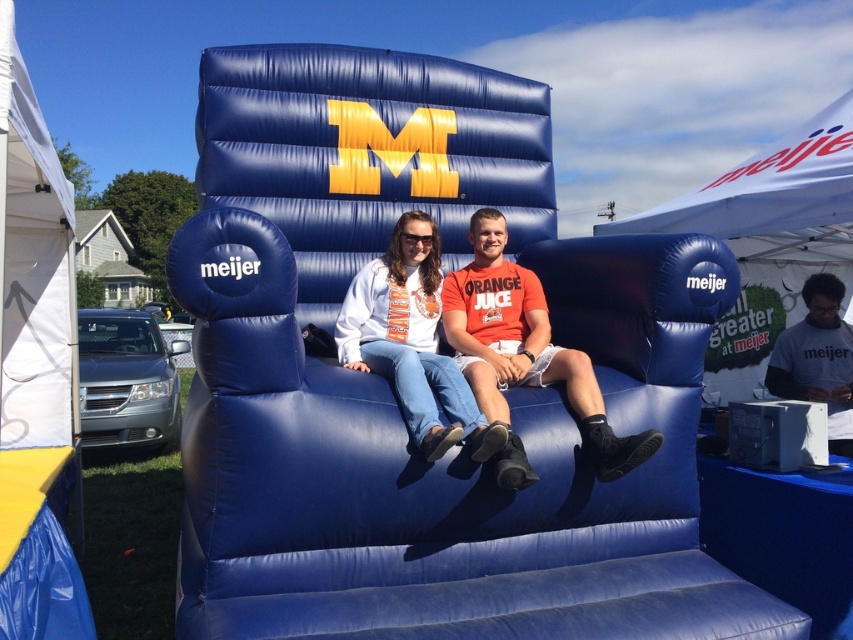
Question: Which of the following is the closest to the observer?

Choices:
 (A) (480, 451)
 (B) (508, 282)

Answer: (A)

Question: Which point is farther from the camera taking this photo?

Choices:
 (A) (848, 364)
 (B) (479, 312)
 (C) (431, 454)

Answer: (A)

Question: Where is orange matte shirt at center located in relation to matte white shirt at center in the image?

Choices:
 (A) above
 (B) below

Answer: (A)

Question: In this image, where is orange matte shirt at center located relative to white matte shirt at lower right?

Choices:
 (A) above
 (B) below

Answer: (A)

Question: Where is orange matte shirt at center located in relation to white matte shirt at lower right in the image?

Choices:
 (A) above
 (B) below

Answer: (A)

Question: Which of the following is the closest to the observer?

Choices:
 (A) matte white shirt at center
 (B) white matte shirt at lower right
 (C) orange matte shirt at center

Answer: (A)